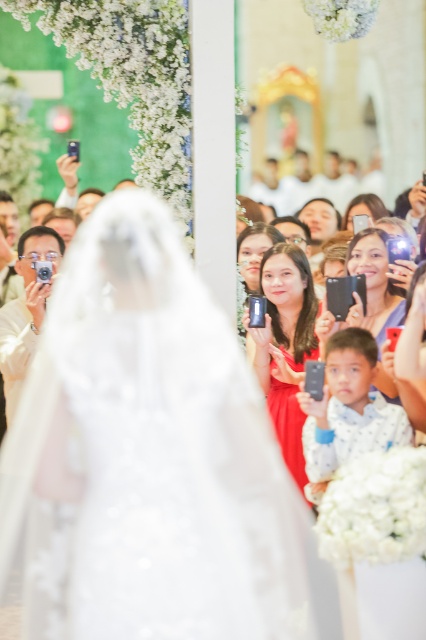
Question: From the image, what is the correct spatial relationship of white lace veil at center in relation to matte black phone at center?

Choices:
 (A) right
 (B) left

Answer: (B)

Question: Which of these objects is positioned closest to the shiny red dress at center?

Choices:
 (A) white lace veil at center
 (B) matte black phone at center

Answer: (B)

Question: Estimate the real-world distances between objects in this image. Which object is farther from the matte silver camera at left?

Choices:
 (A) white lace veil at center
 (B) shiny red dress at center

Answer: (B)

Question: Which point is farther to the camera?

Choices:
 (A) (391, 392)
 (B) (22, 353)
 (C) (374, 212)

Answer: (C)

Question: Does matte black phone at center come behind matte black phone at upper center?

Choices:
 (A) yes
 (B) no

Answer: (B)

Question: Does white lace veil at center appear over matte black phone at upper center?

Choices:
 (A) yes
 (B) no

Answer: (B)